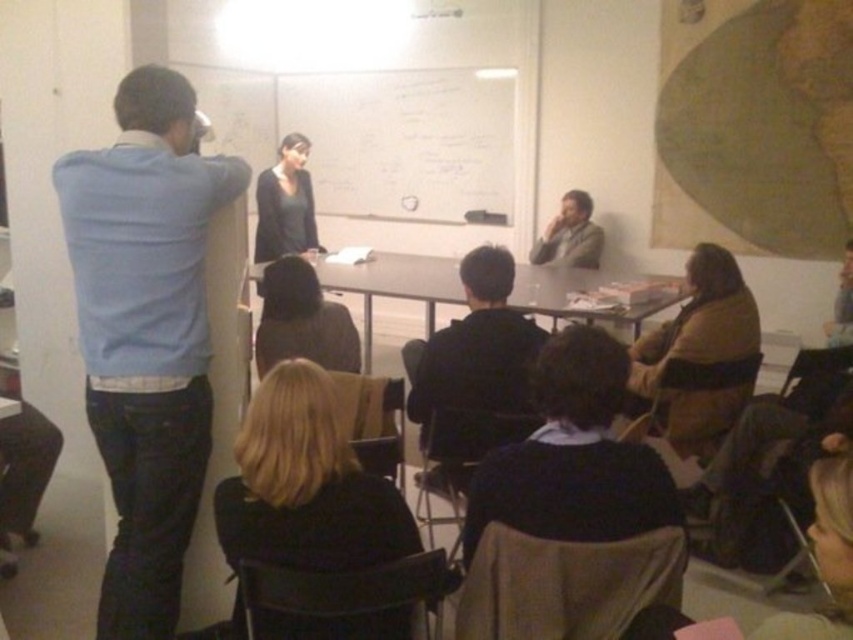
You are a photographer in the back of the room and want to take a photo of both the blue sweater at left and the light brown leather jacket at upper right. Which object should you zoom in on first to ensure both are in frame?

The blue sweater at left is taller than the light brown leather jacket at upper right, so you should zoom in on the blue sweater at left first to ensure both are in frame.

You are standing at the entrance of the room and want to find the blue sweater at left. According to the coordinates given, in which direction should you look to locate it?

The blue sweater at left is located at coordinates point (146, 333), which means it is positioned to the right side of the room from your entrance perspective. You should look to your right to find it.

You are an attendee in the classroom and want to see both the blue sweater at left and the black matte jacket at center clearly. Which one will appear larger in your view?

The blue sweater at left appears larger because it is much taller than the black matte jacket at center.